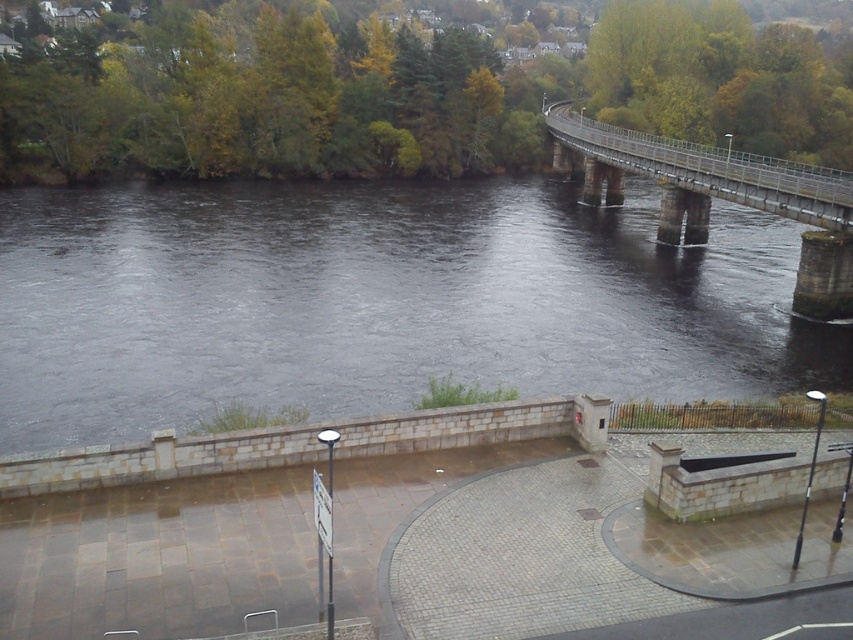
You are a photographer planning to capture the riverside scene. You want to ensure both the dark gray water at center and the metallic gray bridge at upper right are clearly visible in your shot. Based on their positions, which object should appear larger in the photo?

The dark gray water at center appears larger in the photo because it is closer to the viewer than the metallic gray bridge at upper right.

You are a tourist standing on the riverside path and want to take a photo of the metallic gray bridge at upper right. To get the best view, you need to ensure the dark gray water at center is visible in the reflection. Where should you position yourself relative to the bridge?

You should position yourself under the metallic gray bridge at upper right where the dark gray water at center is positioned, as the water is located under the bridge and its reflection would be visible from that vantage point.